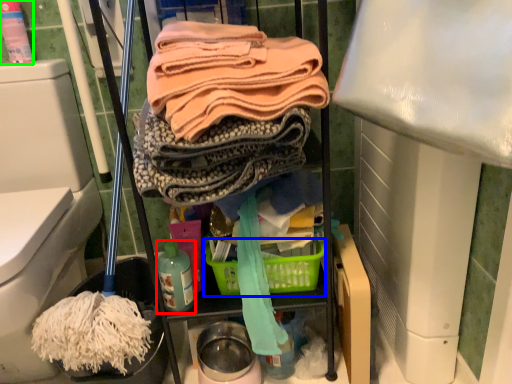
Question: Which is nearer to the bottle (highlighted by a red box)? basket (highlighted by a blue box) or cleaning product (highlighted by a green box).

Choices:
 (A) basket
 (B) cleaning product

Answer: (A)